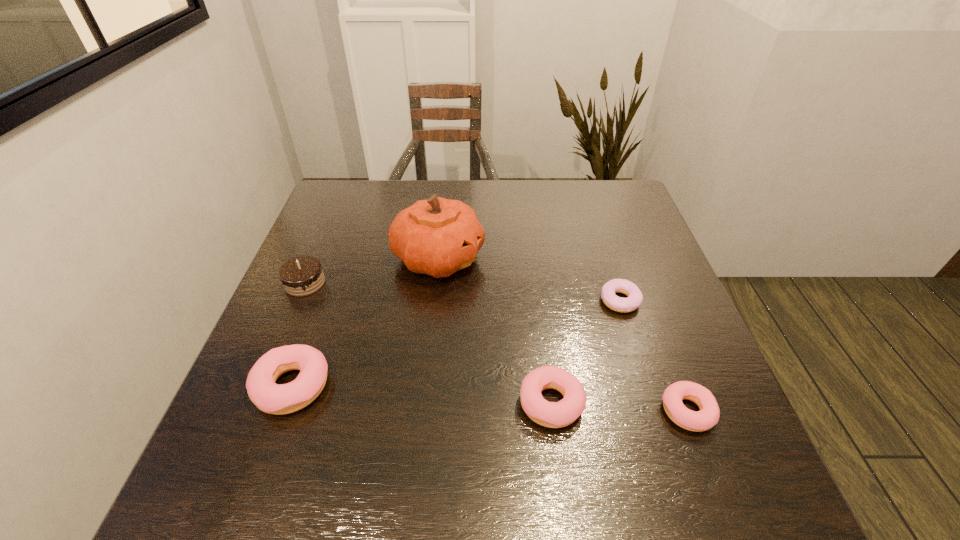
Locate an element on the screen. This screenshot has height=540, width=960. free space at the far left corner is located at coordinates (341, 193).

The width and height of the screenshot is (960, 540). I want to click on vacant space at the far right corner of the desktop, so click(602, 213).

At what (x,y) coordinates should I click in order to perform the action: click on empty location between the leftmost doughnut and the chocolate cake. Please return your answer as a coordinate pair (x, y). Looking at the image, I should click on (299, 335).

Identify the location of free space between the chocolate cake and the fourth shortest object. The height and width of the screenshot is (540, 960). (299, 335).

Find the location of a particular element. vacant region between the third object from left to right and the tallest doughnut is located at coordinates (365, 322).

Identify the location of free spot between the farthest doughnut and the fifth shortest object. (463, 292).

You are a GUI agent. You are given a task and a screenshot of the screen. Output one action in this format:
    pyautogui.click(x=<x>, y=<y>)
    Task: Click on the vacant region between the fourth shortest object and the third doughnut from right to left
    Image resolution: width=960 pixels, height=540 pixels.
    Given the screenshot: What is the action you would take?
    pyautogui.click(x=421, y=395)

I want to click on empty location between the second tallest object and the tallest doughnut, so click(x=299, y=335).

Find the location of a particular element. The width and height of the screenshot is (960, 540). free space between the third object from left to right and the third tallest object is located at coordinates (365, 322).

At what (x,y) coordinates should I click in order to perform the action: click on free space between the chocolate cake and the farthest doughnut. Please return your answer as a coordinate pair (x, y). The image size is (960, 540). Looking at the image, I should click on (463, 292).